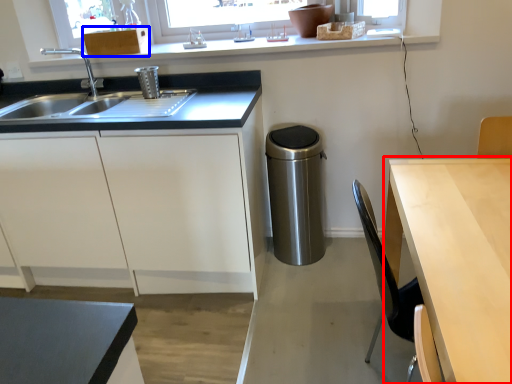
Question: Among these objects, which one is farthest to the camera, table (highlighted by a red box) or cabinetry (highlighted by a blue box)?

Choices:
 (A) table
 (B) cabinetry

Answer: (B)